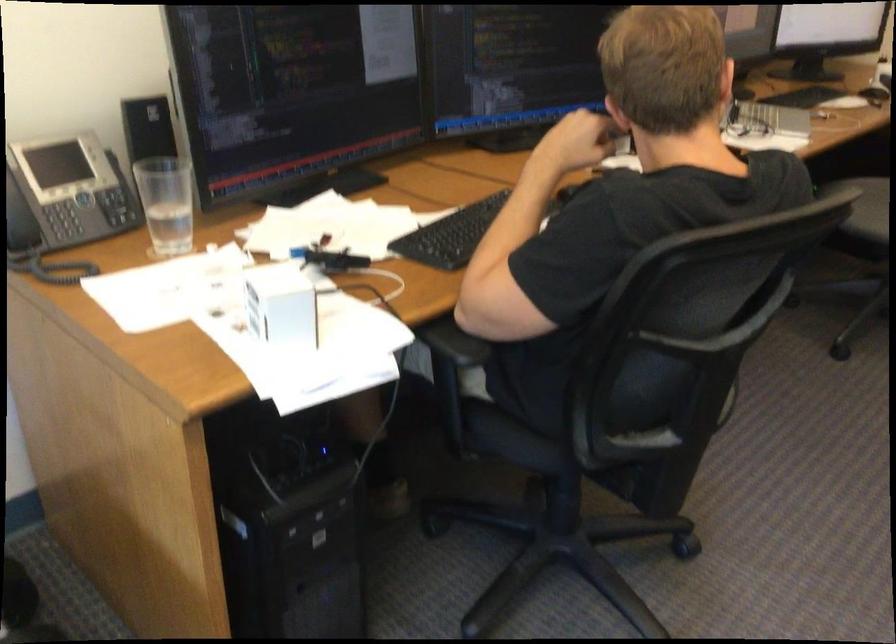
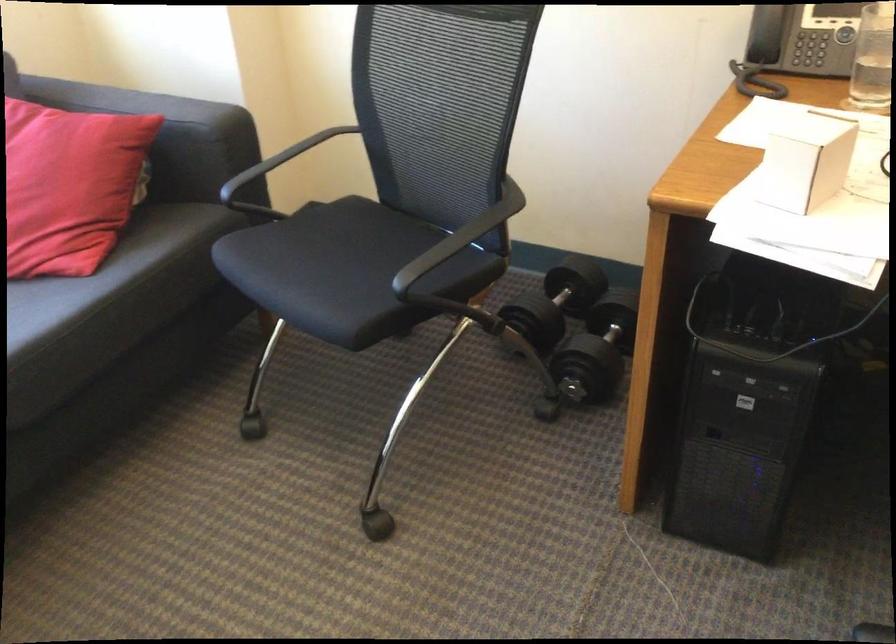
The first image is from the beginning of the video and the second image is from the end. How did the camera likely rotate when shooting the video?

The camera rotated toward left-down.